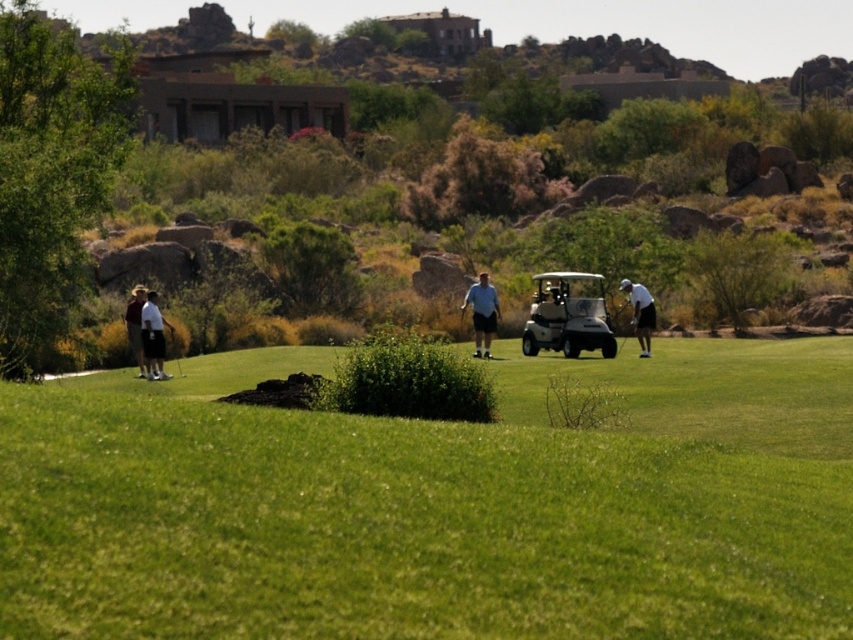
Can you confirm if white matte golf cart at center is taller than white matte golf club at left?

Yes.

Is white matte golf cart at center to the left of white matte golf club at left from the viewer's perspective?

In fact, white matte golf cart at center is to the right of white matte golf club at left.

Which is behind, point (585, 348) or point (144, 336)?

Positioned behind is point (585, 348).

Image resolution: width=853 pixels, height=640 pixels. Identify the location of white matte golf cart at center. (567, 316).

Is white matte golf cart at center below brown leather hat at left?

Yes, white matte golf cart at center is below brown leather hat at left.

Who is higher up, white matte golf cart at center or brown leather hat at left?

brown leather hat at left is higher up.

Describe the element at coordinates (567, 316) in the screenshot. This screenshot has height=640, width=853. I see `white matte golf cart at center` at that location.

The image size is (853, 640). I want to click on white matte golf cart at center, so (x=567, y=316).

Consider the image. Does white matte golf cart at center have a greater height compared to metallic silver golf club at center?

Correct, white matte golf cart at center is much taller as metallic silver golf club at center.

Which is in front, point (531, 353) or point (624, 340)?

Point (531, 353)

Find the location of a particular element. The height and width of the screenshot is (640, 853). white matte golf cart at center is located at coordinates (567, 316).

Identify the location of white matte golf cart at center. The width and height of the screenshot is (853, 640). (567, 316).